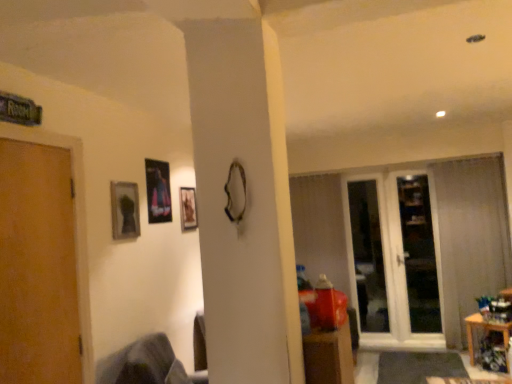
Question: Would you say wooden door at left is to the left or to the right of wooden picture frame at center, positioned as the first picture frame in right-to-left order, in the picture?

Choices:
 (A) right
 (B) left

Answer: (B)

Question: Is wooden door at left inside or outside of wooden picture frame at center, which is the third picture frame from left to right?

Choices:
 (A) inside
 (B) outside

Answer: (B)

Question: Estimate the real-world distances between objects in this image. Which object is farther from the dark gray fabric swivel chair at lower left?

Choices:
 (A) wooden door at left
 (B) matte glass picture frame at upper left, which appears as the 3th picture frame when viewed from the back
 (C) white plastic screen door at right
 (D) wooden picture frame at center, which ranks as the third picture frame in front-to-back order
 (E) wooden table at lower right

Answer: (E)

Question: Estimate the real-world distances between objects in this image. Which object is farther from the wooden table at lower right?

Choices:
 (A) wooden picture frame at center, which ranks as the third picture frame in front-to-back order
 (B) dark gray fabric swivel chair at lower left
 (C) wooden door at left
 (D) metallic glossy picture frame at upper center, which ranks as the second picture frame in front-to-back order
 (E) matte glass picture frame at upper left, which is the third picture frame in right-to-left order

Answer: (C)